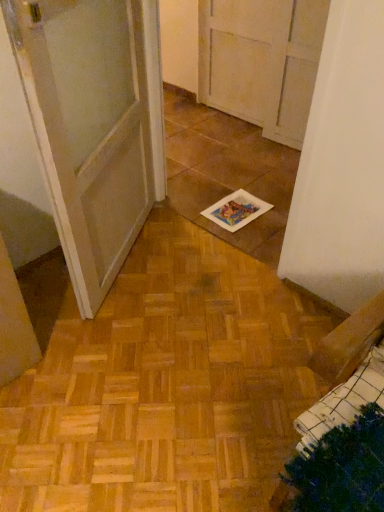
This screenshot has height=512, width=384. What are the coordinates of `vacant region below white glossy door at center (from a real-world perspective)` in the screenshot? It's located at (132, 257).